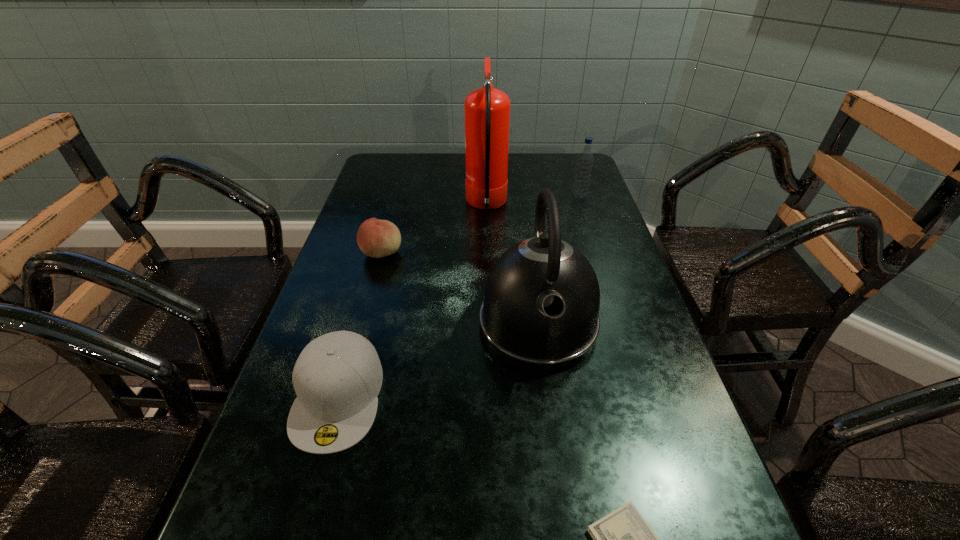
Locate an element on the screen. Image resolution: width=960 pixels, height=540 pixels. vacant point at the far right corner is located at coordinates (565, 159).

What are the coordinates of `empty space between the fire extinguisher and the fourth nearest object` in the screenshot? It's located at (434, 229).

Identify the location of free space that is in between the cap and the peach. The width and height of the screenshot is (960, 540). (360, 325).

Where is `free space between the fourth nearest object and the fifth shortest object`? free space between the fourth nearest object and the fifth shortest object is located at coordinates (460, 288).

What are the coordinates of `free spot between the third farthest object and the kettle` in the screenshot? It's located at (460, 288).

You are a GUI agent. You are given a task and a screenshot of the screen. Output one action in this format:
    pyautogui.click(x=<x>, y=<y>)
    Task: Click on the unoccupied position between the cap and the water bottle
    This screenshot has height=540, width=960.
    Given the screenshot: What is the action you would take?
    pyautogui.click(x=459, y=296)

The image size is (960, 540). In order to click on vacant space that is in between the tallest object and the cap in this screenshot , I will do `click(413, 300)`.

Where is `vacant space that's between the fourth nearest object and the water bottle`? The image size is (960, 540). vacant space that's between the fourth nearest object and the water bottle is located at coordinates (481, 225).

Locate which object is the fourth closest to the dollar. Please provide its 2D coordinates. Your answer should be formatted as a tuple, i.e. [(x, y)], where the tuple contains the x and y coordinates of a point satisfying the conditions above.

[(487, 110)]

Select which object appears as the fifth closest to the dollar. Please provide its 2D coordinates. Your answer should be formatted as a tuple, i.e. [(x, y)], where the tuple contains the x and y coordinates of a point satisfying the conditions above.

[(585, 160)]